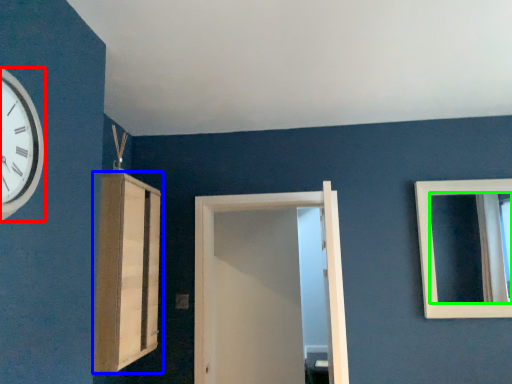
Question: Which object is the farthest from wall clock (highlighted by a red box)? Choose among these: cabinetry (highlighted by a blue box) or mirror (highlighted by a green box).

Choices:
 (A) cabinetry
 (B) mirror

Answer: (B)